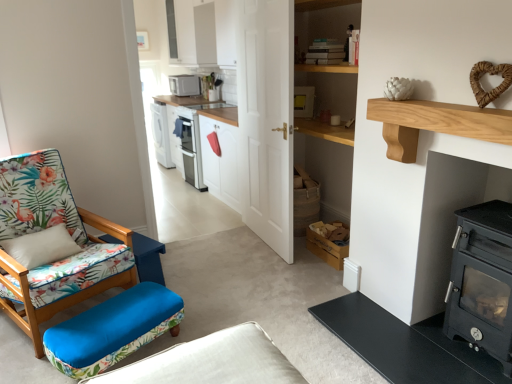
In order to click on free space above blue fabric swivel chair at left (from a real-world perspective) in this screenshot , I will do `click(116, 316)`.